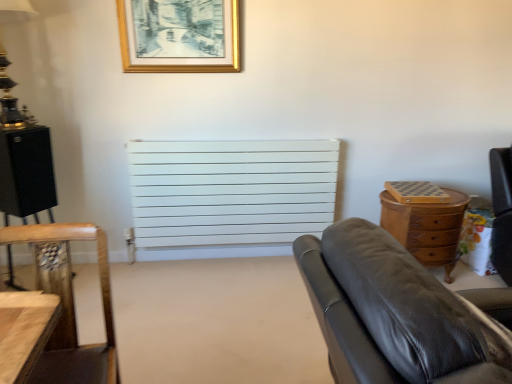
This screenshot has width=512, height=384. What are the coordinates of `vacant point above white matte radiator at center (from a real-world perspective)` in the screenshot? It's located at (229, 131).